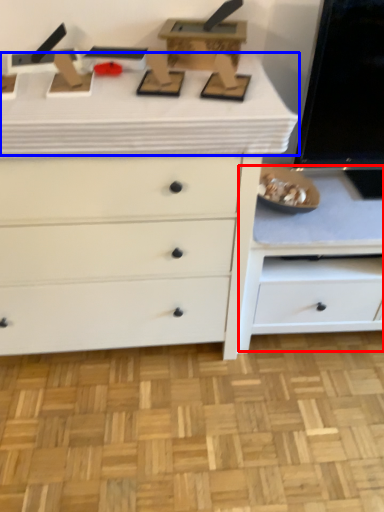
Question: Which object is closer to the camera taking this photo, cabinetry (highlighted by a red box) or counter top (highlighted by a blue box)?

Choices:
 (A) cabinetry
 (B) counter top

Answer: (B)